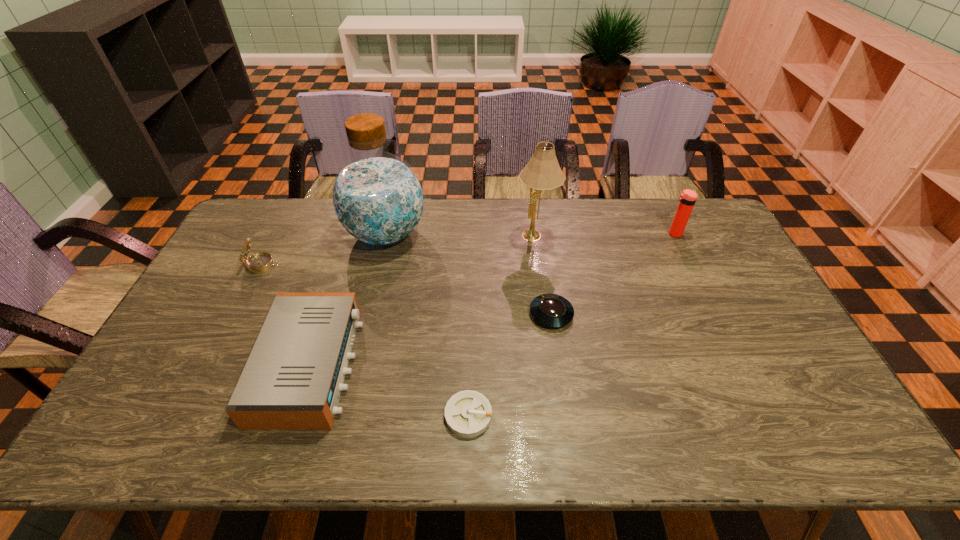
You are a GUI agent. You are given a task and a screenshot of the screen. Output one action in this format:
    pyautogui.click(x=<x>, y=<y>)
    Task: Click on the free space located on the left of the water jug
    
    Given the screenshot: What is the action you would take?
    point(276,234)

Where is `free spot located 0.330m on the front of the lampshade`? free spot located 0.330m on the front of the lampshade is located at coordinates pyautogui.click(x=548, y=327).

What are the coordinates of `vacant space situated on the front of the fifth shortest object` in the screenshot? It's located at (686, 260).

Locate an element on the screen. The image size is (960, 540). blank space located with the dial facing the leftmost object is located at coordinates (309, 265).

Locate an element on the screen. free space located 0.140m on the control panel of the third shortest object is located at coordinates (408, 365).

Locate an element on the screen. The height and width of the screenshot is (540, 960). vacant space situated 0.190m on the front of the sixth tallest object is located at coordinates (563, 392).

The image size is (960, 540). Identify the location of free space located on the left of the fourth object from left to right. (424, 415).

At what (x,y) coordinates should I click in order to perform the action: click on water jug situated at the far edge. Please return your answer as a coordinate pair (x, y). This screenshot has width=960, height=540. Looking at the image, I should click on (378, 199).

Locate an element on the screen. The width and height of the screenshot is (960, 540). lampshade that is positioned at the far edge is located at coordinates (542, 172).

Where is `thermos bottle at the far edge`? thermos bottle at the far edge is located at coordinates (687, 199).